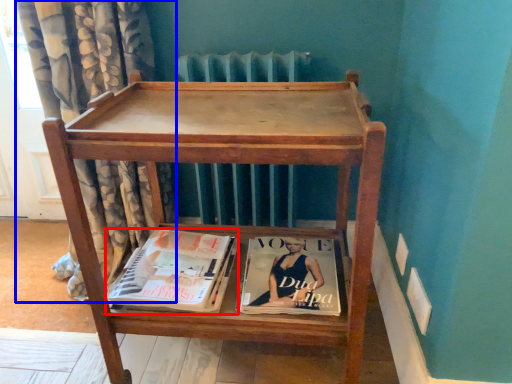
Question: Which object is closer to the camera taking this photo, book (highlighted by a red box) or curtain (highlighted by a blue box)?

Choices:
 (A) book
 (B) curtain

Answer: (B)